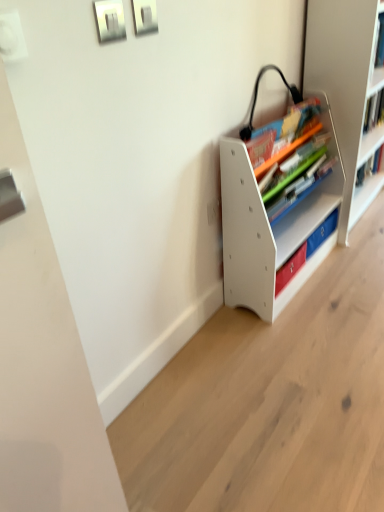
At what (x,y) coordinates should I click in order to perform the action: click on free space in front of white matte bookshelf at center, which is the first shelf from left to right. Please return your answer as a coordinate pair (x, y). The height and width of the screenshot is (512, 384). Looking at the image, I should click on (298, 339).